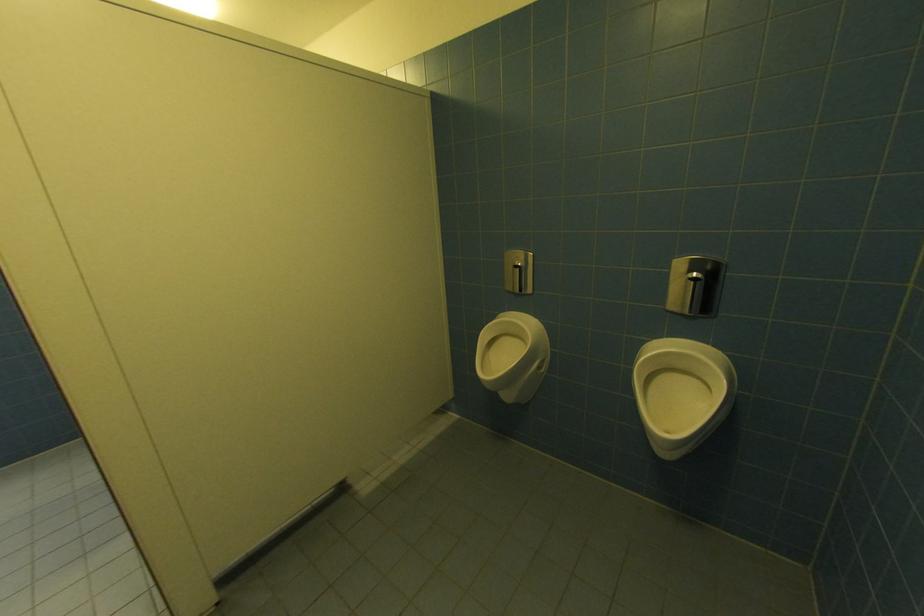
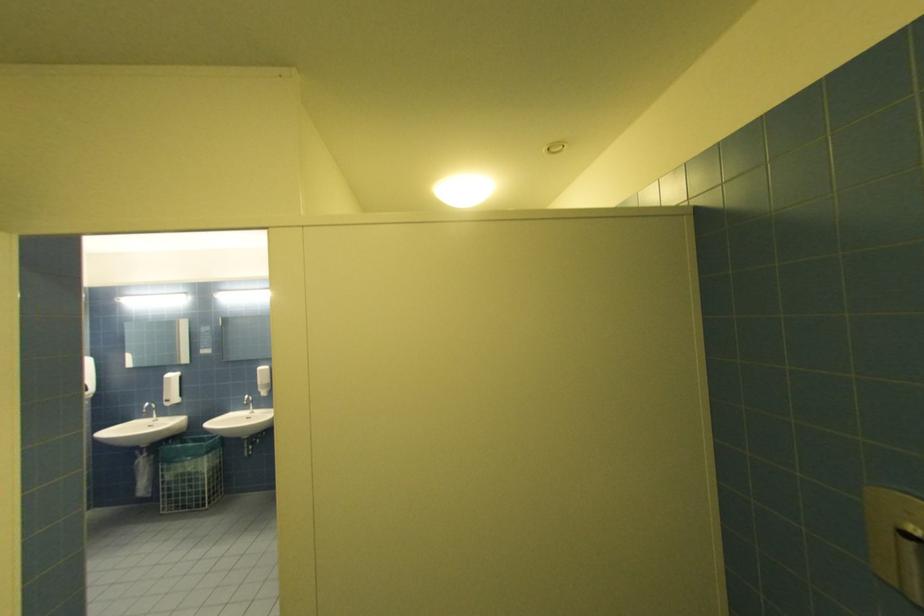
Question: The camera is either moving clockwise (left) or counter-clockwise (right) around the object. The first image is from the beginning of the video and the second image is from the end. Is the camera moving left or right when shooting the video?

Choices:
 (A) Left
 (B) Right

Answer: (B)